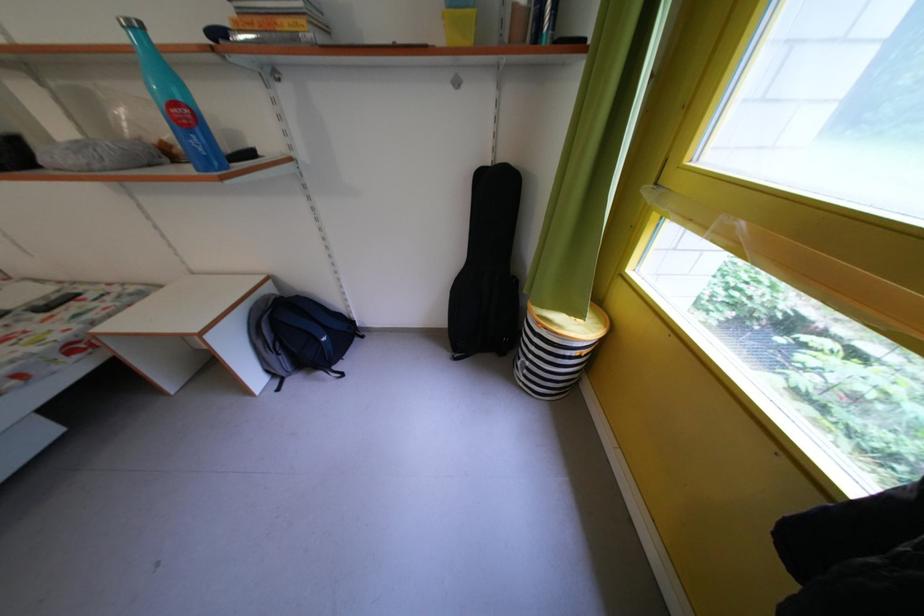
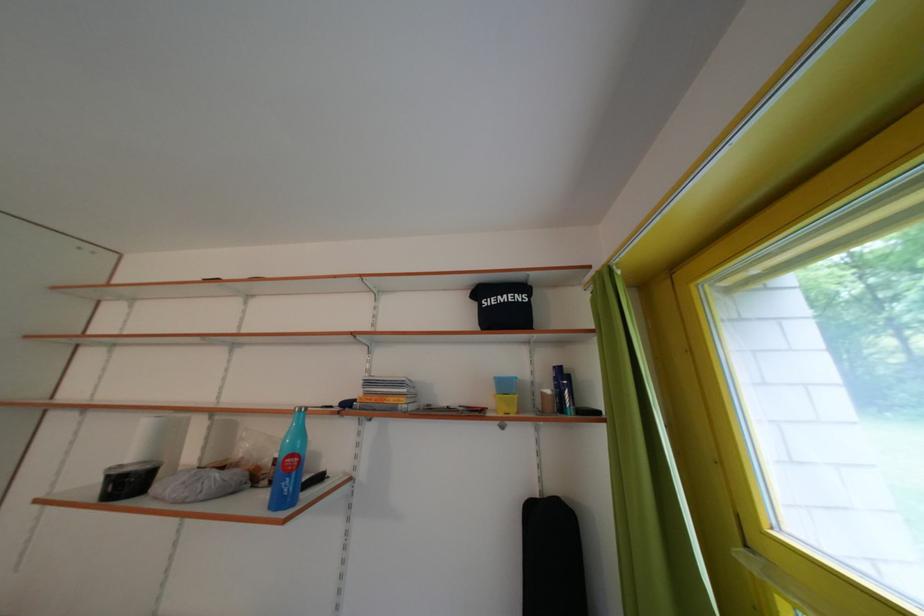
Question: The first image is from the beginning of the video and the second image is from the end. How did the camera likely rotate when shooting the video?

Choices:
 (A) Left
 (B) Right
 (C) Up
 (D) Down

Answer: (C)